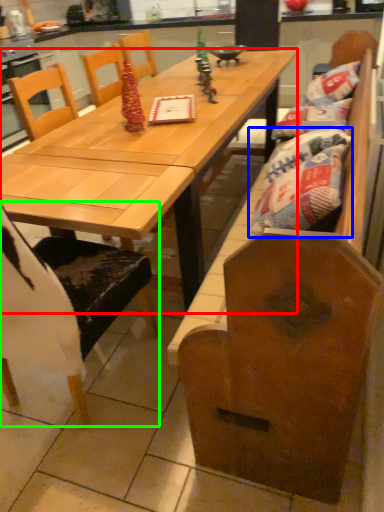
Question: Based on their relative distances, which object is farther from table (highlighted by a red box)? Choose from material (highlighted by a blue box) and chair (highlighted by a green box).

Choices:
 (A) material
 (B) chair

Answer: (B)